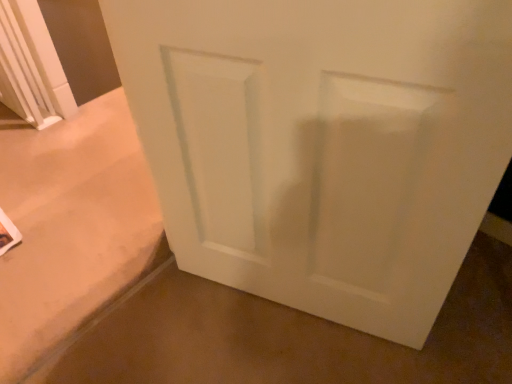
What are the coordinates of `white smooth door at center` in the screenshot? It's located at (285, 336).

Image resolution: width=512 pixels, height=384 pixels. What do you see at coordinates (285, 336) in the screenshot? I see `white smooth door at center` at bounding box center [285, 336].

In the scene shown: What is the approximate height of white matte door at center?

white matte door at center is 89.06 centimeters in height.

Describe the element at coordinates (322, 144) in the screenshot. The image size is (512, 384). I see `white matte door at center` at that location.

You are a GUI agent. You are given a task and a screenshot of the screen. Output one action in this format:
    pyautogui.click(x=<x>, y=<y>)
    Task: Click on the white matte door at center
    
    Given the screenshot: What is the action you would take?
    pyautogui.click(x=322, y=144)

Locate an element on the screen. white smooth door at center is located at coordinates (285, 336).

Which is more to the left, white matte door at center or white smooth door at center?

white matte door at center.

In the image, is white matte door at center positioned in front of or behind white smooth door at center?

Clearly, white matte door at center is in front of white smooth door at center.

Which point is more forward, (478, 23) or (229, 372)?

The point (478, 23) is more forward.

From the image's perspective, is white matte door at center located above white smooth door at center?

Yes, from the image's perspective, white matte door at center is over white smooth door at center.

Based on the photo, from a real-world perspective, which is physically above, white matte door at center or white smooth door at center?

white matte door at center is physically above.

Considering the sizes of objects white matte door at center and white smooth door at center in the image provided, who is wider, white matte door at center or white smooth door at center?

Wider between the two is white smooth door at center.

Between white matte door at center and white smooth door at center, which one has more height?

With more height is white matte door at center.

Which of these two, white matte door at center or white smooth door at center, is smaller?

white smooth door at center.

Choose the correct answer: Is white matte door at center inside white smooth door at center or outside it?

white matte door at center exists outside the volume of white smooth door at center.

Can you see white matte door at center touching white smooth door at center?

No.

Is white matte door at center positioned with its back to white smooth door at center?

white matte door at center is not turned away from white smooth door at center.

The height and width of the screenshot is (384, 512). What are the coordinates of `door above the white smooth door at center (from a real-world perspective)` in the screenshot? It's located at (322, 144).

Based on their positions, is white smooth door at center located to the left or right of white matte door at center?

Result: In the image, white smooth door at center appears on the right side of white matte door at center.

Does white smooth door at center come in front of white matte door at center?

No, it is behind white matte door at center.

From the picture: Which point is more distant from viewer, (297, 367) or (400, 20)?

Positioned behind is point (297, 367).

Based on the photo, from the image's perspective, between white smooth door at center and white matte door at center, who is located below?

white smooth door at center, from the image's perspective.

From a real-world perspective, does white smooth door at center sit lower than white matte door at center?

Yes, from a real-world perspective, white smooth door at center is beneath white matte door at center.

Looking at their sizes, would you say white smooth door at center is wider or thinner than white matte door at center?

Clearly, white smooth door at center has more width compared to white matte door at center.

Between white smooth door at center and white matte door at center, which one has more height?

With more height is white matte door at center.

Considering the sizes of objects white smooth door at center and white matte door at center in the image provided, who is bigger, white smooth door at center or white matte door at center?

With larger size is white matte door at center.

Is white smooth door at center not inside white matte door at center?

Yes, white smooth door at center is not within white matte door at center.

Is white smooth door at center beside white matte door at center?

white smooth door at center is not next to white matte door at center, and they're not touching.

Could you tell me if white smooth door at center is turned towards white matte door at center?

No, white smooth door at center is not facing towards white matte door at center.

How many degrees apart are the facing directions of white smooth door at center and white matte door at center?

70.5 degrees.

Based on the photo, measure the distance between white smooth door at center and white matte door at center.

white smooth door at center is 46.39 centimeters from white matte door at center.

Identify the location of door on the left of white smooth door at center. (322, 144).

Where is `door lying on the left of white smooth door at center`? Image resolution: width=512 pixels, height=384 pixels. door lying on the left of white smooth door at center is located at coordinates (322, 144).

The width and height of the screenshot is (512, 384). In order to click on door above the white smooth door at center (from a real-world perspective) in this screenshot , I will do `click(322, 144)`.